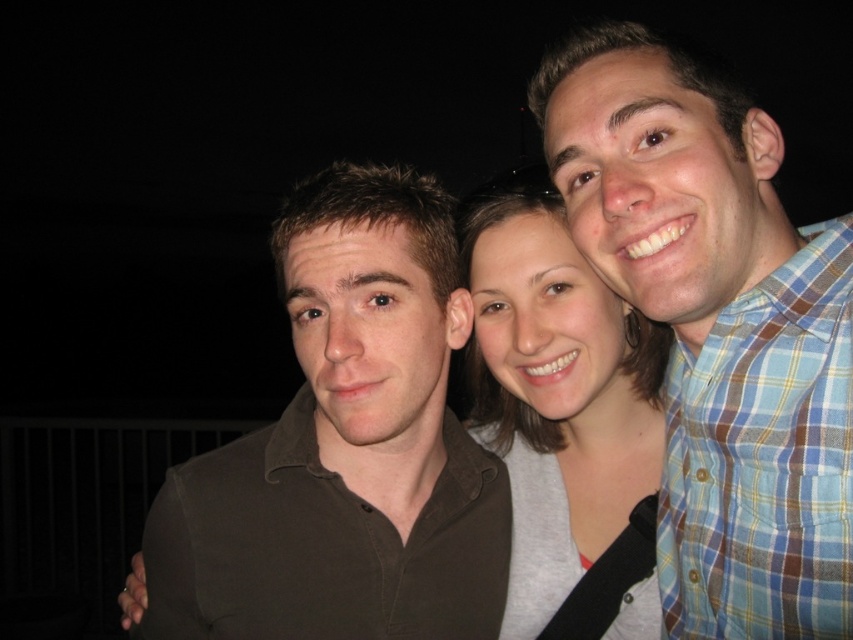
Question: In this image, where is blue plaid shirt at right located relative to matte gray shirt at center?

Choices:
 (A) above
 (B) below

Answer: (A)

Question: Considering the relative positions of dark brown cotton shirt at center and matte gray shirt at center in the image provided, where is dark brown cotton shirt at center located with respect to matte gray shirt at center?

Choices:
 (A) below
 (B) above

Answer: (A)

Question: Which object is the closest to the matte gray shirt at center?

Choices:
 (A) dark brown cotton shirt at center
 (B) blue plaid shirt at right

Answer: (A)

Question: Can you confirm if blue plaid shirt at right is thinner than dark brown cotton shirt at center?

Choices:
 (A) no
 (B) yes

Answer: (B)

Question: Which point is farther to the camera?

Choices:
 (A) matte gray shirt at center
 (B) dark brown cotton shirt at center

Answer: (A)

Question: Considering the real-world distances, which object is closest to the matte gray shirt at center?

Choices:
 (A) blue plaid shirt at right
 (B) dark brown cotton shirt at center

Answer: (B)